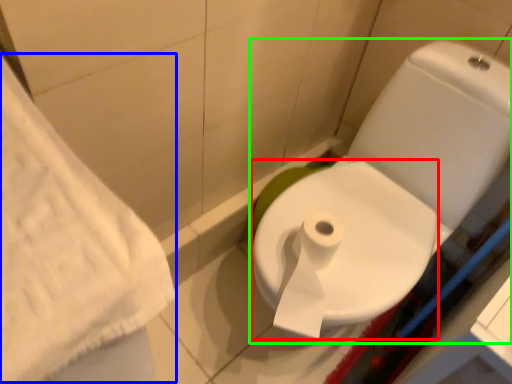
Question: Which object is the farthest from bidet (highlighted by a red box)? Choose among these: bath towel (highlighted by a blue box) or toilet (highlighted by a green box).

Choices:
 (A) bath towel
 (B) toilet

Answer: (A)